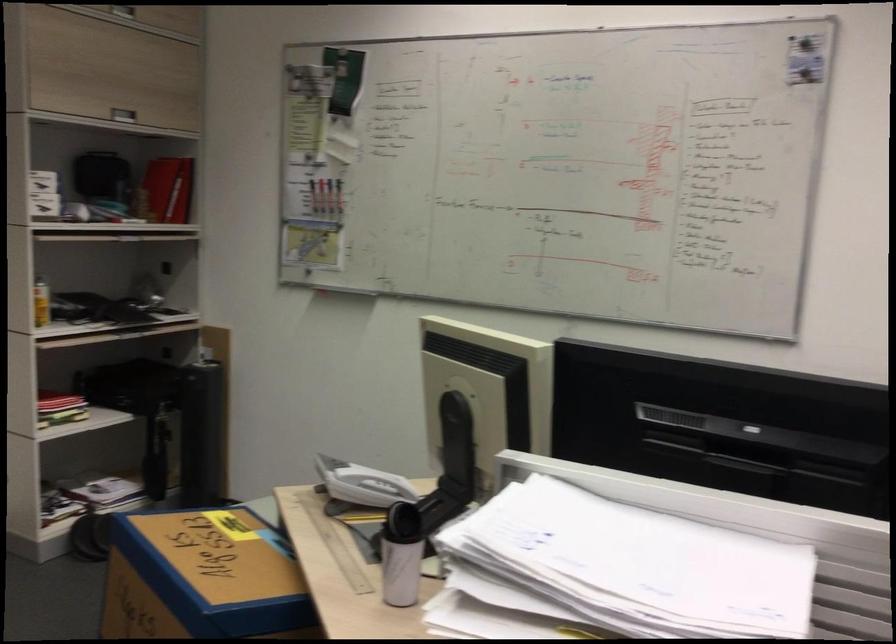
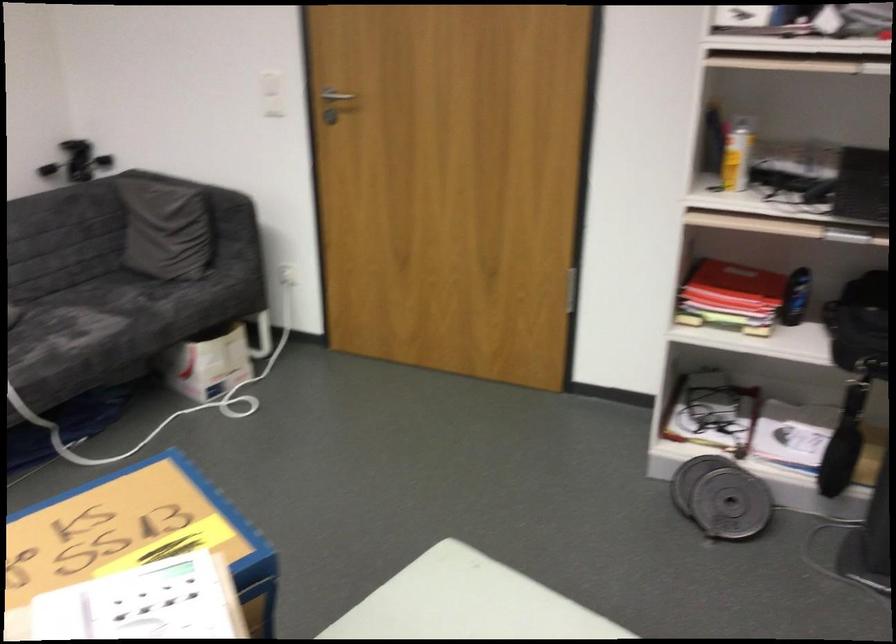
Where in the second image is the point corresponding to point 147,389 from the first image?

(859, 325)